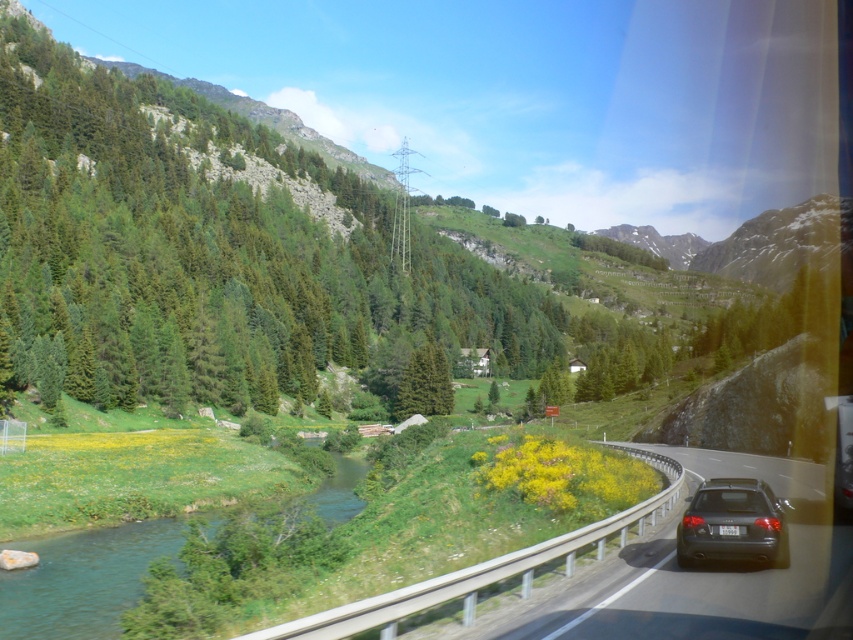
Question: Is black asphalt highway at center positioned before dark gray metallic car at lower right?

Choices:
 (A) no
 (B) yes

Answer: (B)

Question: Is black asphalt highway at center positioned in front of dark gray metallic car at lower right?

Choices:
 (A) yes
 (B) no

Answer: (A)

Question: Estimate the real-world distances between objects in this image. Which object is closer to the dark gray metallic car at lower right?

Choices:
 (A) green grassy river at lower left
 (B) black asphalt highway at center
 (C) green matte tree at center

Answer: (B)

Question: Where is dark gray metallic car at lower right located in relation to green matte tree at center in the image?

Choices:
 (A) right
 (B) left

Answer: (A)

Question: Which point is farther to the camera?

Choices:
 (A) green grassy river at lower left
 (B) dark gray metallic car at lower right
 (C) black asphalt highway at center
 (D) green matte tree at center

Answer: (D)

Question: Which object appears closest to the camera in this image?

Choices:
 (A) dark gray metallic car at lower right
 (B) green matte tree at center

Answer: (A)